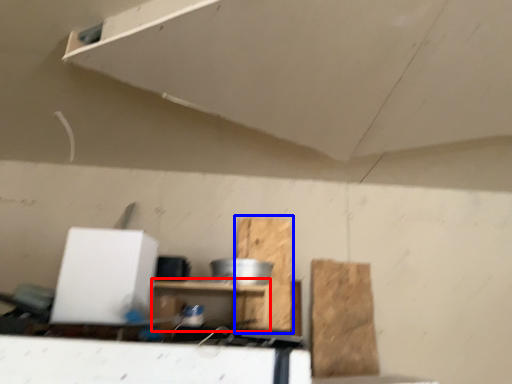
Question: Which point is closer to the camera, furniture (highlighted by a red box) or cardboard (highlighted by a blue box)?

Choices:
 (A) furniture
 (B) cardboard

Answer: (A)